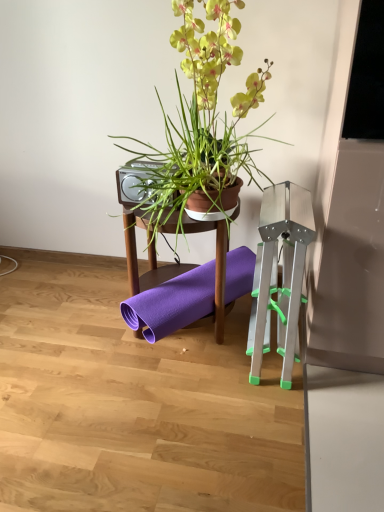
Question: In terms of height, does silver metallic speaker at upper center look taller or shorter compared to green matte plant pot at upper center?

Choices:
 (A) tall
 (B) short

Answer: (B)

Question: Is silver metallic speaker at upper center spatially inside green matte plant pot at upper center, or outside of it?

Choices:
 (A) outside
 (B) inside

Answer: (B)

Question: Estimate the real-world distances between objects in this image. Which object is closer to the silver metallic speaker at upper center?

Choices:
 (A) metallic silver easel at right
 (B) purple rubber yoga mat at center
 (C) green matte plant pot at upper center

Answer: (C)

Question: Which is farther from the metallic silver easel at right?

Choices:
 (A) purple rubber yoga mat at center
 (B) green matte plant pot at upper center
 (C) silver metallic speaker at upper center

Answer: (C)